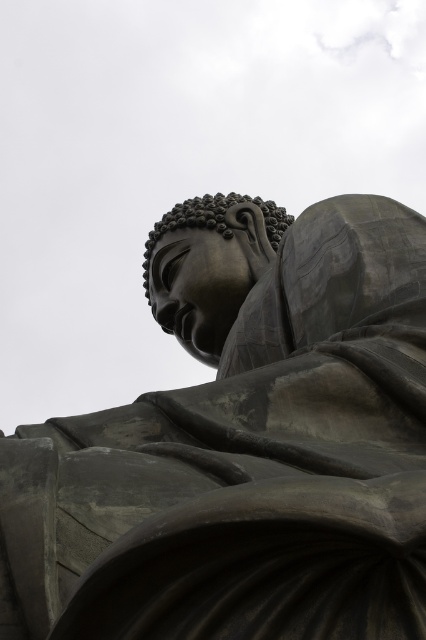
Can you confirm if bronze statue at center is wider than matte bronze head at center?

Correct, the width of bronze statue at center exceeds that of matte bronze head at center.

Can you confirm if bronze statue at center is shorter than matte bronze head at center?

No, bronze statue at center is not shorter than matte bronze head at center.

Is point (199, 627) farther from camera compared to point (245, 257)?

No.

Where is `bronze statue at center`? The image size is (426, 640). bronze statue at center is located at coordinates (242, 444).